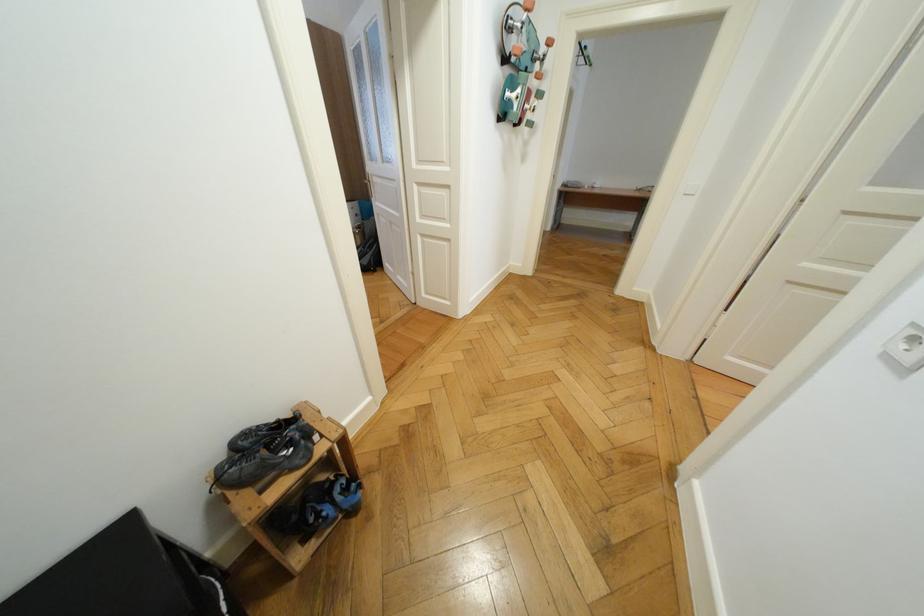
The width and height of the screenshot is (924, 616). What do you see at coordinates (367, 180) in the screenshot?
I see `the gold door handle` at bounding box center [367, 180].